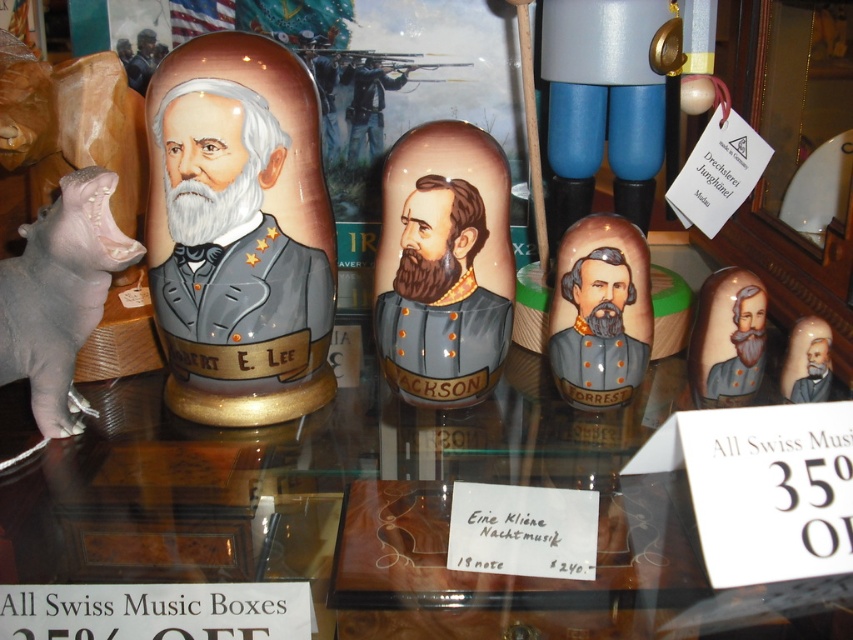
Question: Is blue plastic nutcracker at upper center below matte gold nesting doll at center?

Choices:
 (A) yes
 (B) no

Answer: (B)

Question: Which object is farther from the camera taking this photo?

Choices:
 (A) matte gold nesting doll at center
 (B) gray matte hippo at left

Answer: (A)

Question: Does matte gold uniform at center have a greater width compared to matte ceramic figurine at center?

Choices:
 (A) no
 (B) yes

Answer: (B)

Question: Does matte gold uniform at center appear on the left side of matte brown uniform at center?

Choices:
 (A) yes
 (B) no

Answer: (B)

Question: Among these points, which one is nearest to the camera?

Choices:
 (A) (798, 320)
 (B) (645, 276)
 (C) (718, 278)

Answer: (B)

Question: Which object is the closest to the blue plastic nutcracker at upper center?

Choices:
 (A) matte ceramic figurine at center
 (B) matte gold figurine at center
 (C) matte gold uniform at center
 (D) matte gold nesting doll at center

Answer: (D)